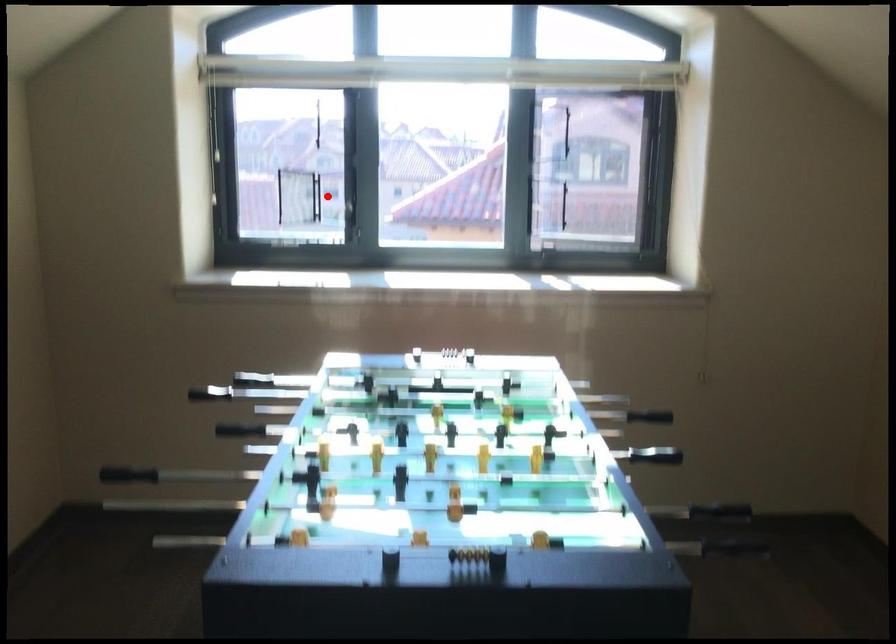
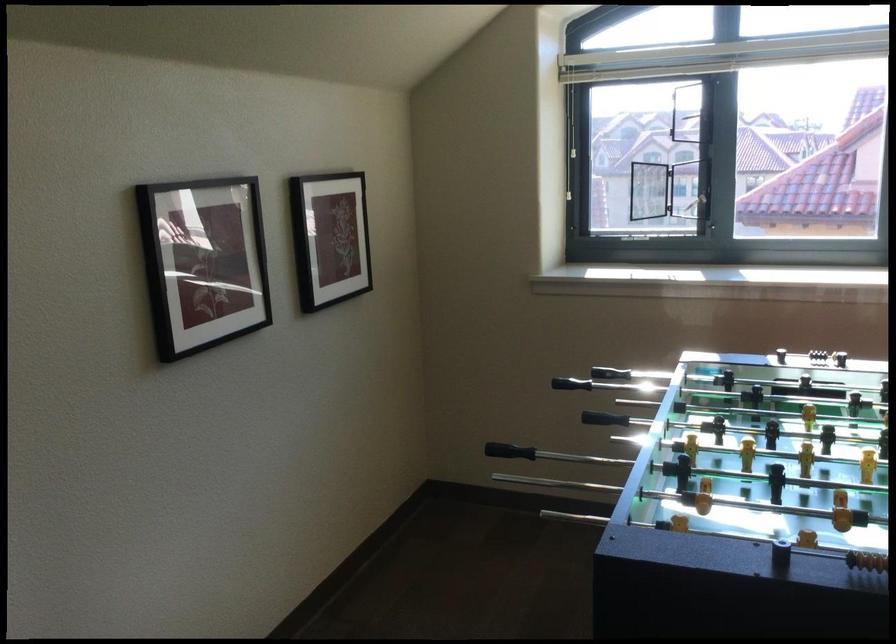
In the second image, find the point that corresponds to the highlighted location in the first image.

(688, 189)